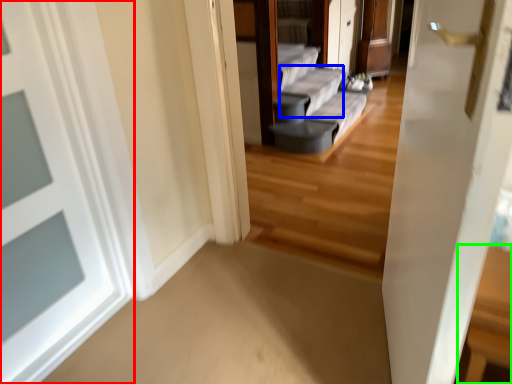
Question: Which is farther away from door (highlighted by a red box)? couch (highlighted by a blue box) or table (highlighted by a green box)?

Choices:
 (A) couch
 (B) table

Answer: (A)